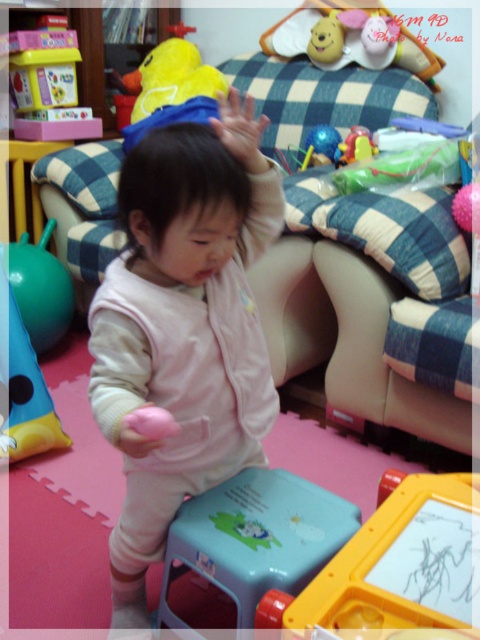
Question: Does yellow plastic drawing board at lower center have a larger size compared to matte plastic toy at upper left?

Choices:
 (A) yes
 (B) no

Answer: (B)

Question: Can you confirm if yellow plush duck at upper center is smaller than yellow fabric duck at upper left?

Choices:
 (A) no
 (B) yes

Answer: (B)

Question: Considering the real-world distances, which object is closest to the yellow fabric duck at upper left?

Choices:
 (A) rubber duck at center
 (B) yellow plastic drawing board at lower center
 (C) green rubber ball at left
 (D) matte plastic toy at upper left

Answer: (D)

Question: Does yellow plush duck at upper center appear on the right side of green rubber ball at left?

Choices:
 (A) yes
 (B) no

Answer: (A)

Question: Estimate the real-world distances between objects in this image. Which object is closer to the yellow plastic drawing board at lower center?

Choices:
 (A) yellow fabric duck at upper left
 (B) matte plastic toy at upper left

Answer: (A)

Question: Which object is the closest to the yellow plastic drawing board at lower center?

Choices:
 (A) yellow fabric duck at upper left
 (B) rubber duck at center
 (C) green rubber ball at left

Answer: (B)